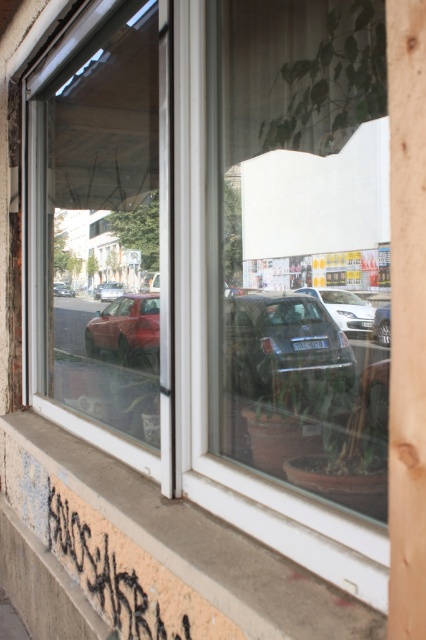
Which is below, shiny metallic car at center or satin silver sedan at center?

shiny metallic car at center is lower down.

Can you confirm if shiny metallic car at center is shorter than satin silver sedan at center?

Yes.

Does point (287, 380) lie in front of point (316, 291)?

That is True.

Find the location of a particular element. shiny metallic car at center is located at coordinates (285, 348).

Is shiny red car at left shorter than satin silver sedan at center?

In fact, shiny red car at left may be taller than satin silver sedan at center.

Can you confirm if shiny red car at left is bigger than satin silver sedan at center?

Indeed, shiny red car at left has a larger size compared to satin silver sedan at center.

Measure the distance between shiny red car at left and camera.

6.67 meters

The image size is (426, 640). In order to click on shiny red car at left in this screenshot , I will do coord(126,330).

Is point (149, 632) in front of point (57, 296)?

Yes, point (149, 632) is closer to viewer.

Between black graffiti at lower left and matte red car at left, which one has more height?

Standing taller between the two is matte red car at left.

Is point (66, 502) positioned behind point (57, 282)?

No.

What are the coordinates of `black graffiti at lower left` in the screenshot? It's located at (103, 573).